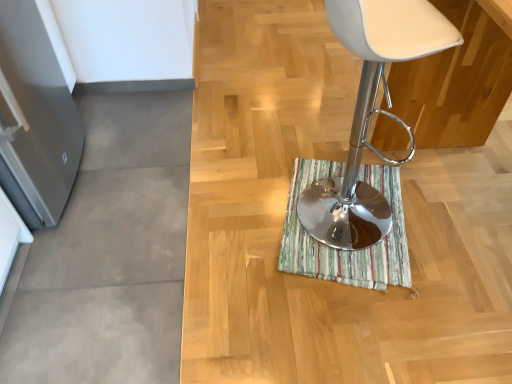
I want to click on free location to the right of striped fabric bath mat at center, so click(x=453, y=219).